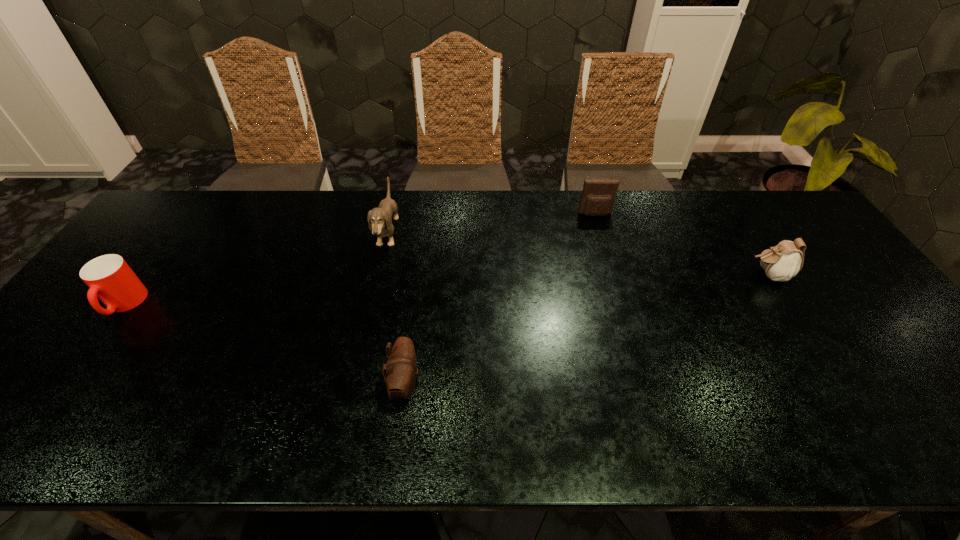
Image resolution: width=960 pixels, height=540 pixels. I want to click on vacant space located on the front-facing side of the rightmost pouch, so click(642, 275).

Locate an element on the screen. This screenshot has width=960, height=540. free space located on the front-facing side of the rightmost pouch is located at coordinates (695, 275).

Locate an element on the screen. vacant point located 0.330m with an open flap on the second pouch from right to left is located at coordinates (618, 294).

Where is `vacant area situated on the side of the cup with the handle`? This screenshot has width=960, height=540. vacant area situated on the side of the cup with the handle is located at coordinates [x=19, y=448].

Where is `vacant region located 0.180m with the flap open on the nearest pouch`? vacant region located 0.180m with the flap open on the nearest pouch is located at coordinates (499, 384).

Where is `puppy that is at the far edge`? This screenshot has width=960, height=540. puppy that is at the far edge is located at coordinates (381, 218).

Locate an element on the screen. The image size is (960, 540). pouch located in the far edge section of the desktop is located at coordinates (598, 196).

Where is `object located in the near edge section of the desktop`? This screenshot has height=540, width=960. object located in the near edge section of the desktop is located at coordinates (401, 368).

Locate an element on the screen. object positioned at the left edge is located at coordinates (109, 277).

This screenshot has width=960, height=540. In the image, there is a desktop. Identify the location of vacant space at the far edge. 230,212.